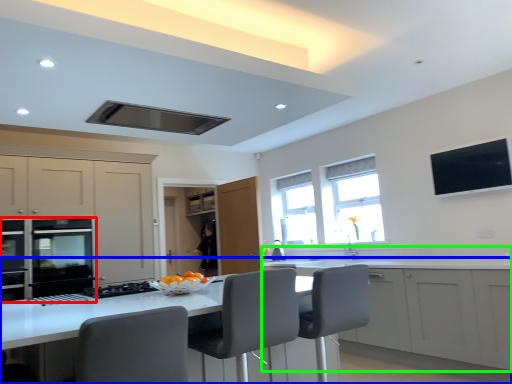
Question: Which object is the farthest from home appliance (highlighted by a red box)? Choose among these: counter (highlighted by a blue box) or cabinetry (highlighted by a green box).

Choices:
 (A) counter
 (B) cabinetry

Answer: (B)